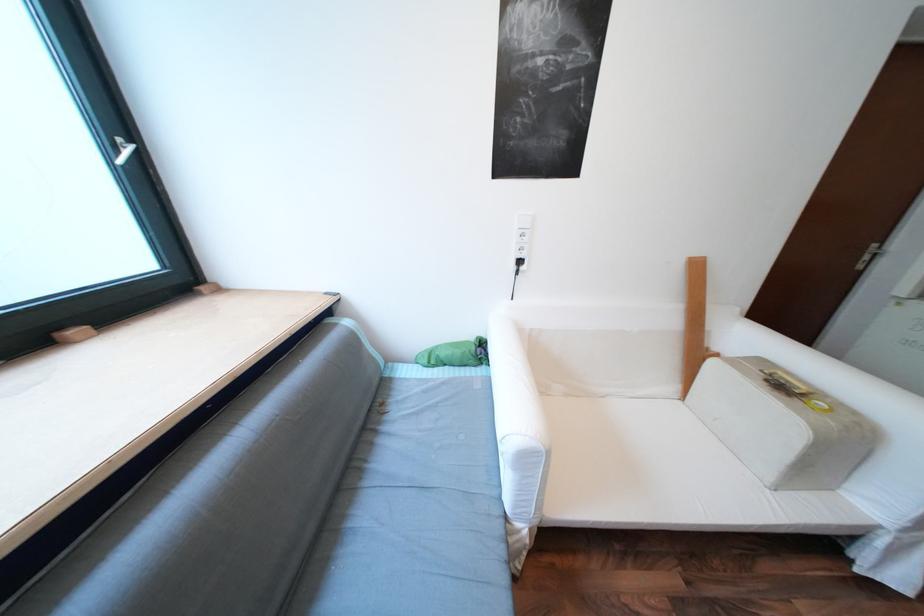
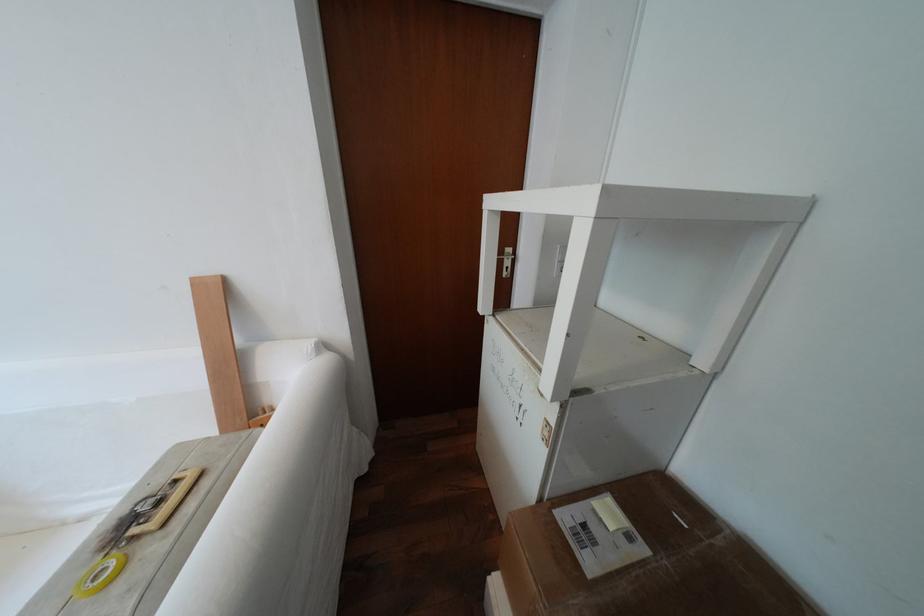
Question: The images are taken continuously from a first-person perspective. In which direction are you moving?

Choices:
 (A) Left
 (B) Right
 (C) Forward
 (D) Backward

Answer: (B)